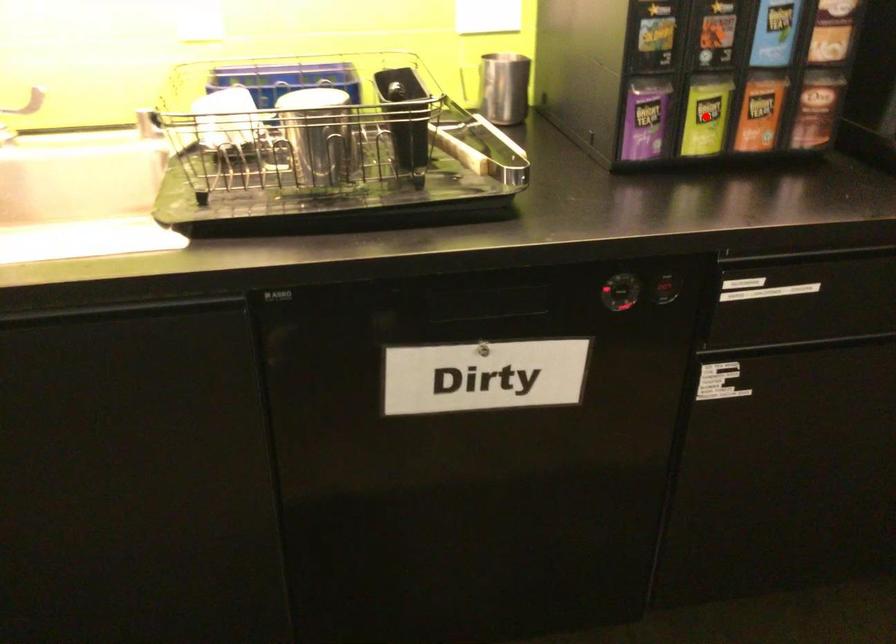
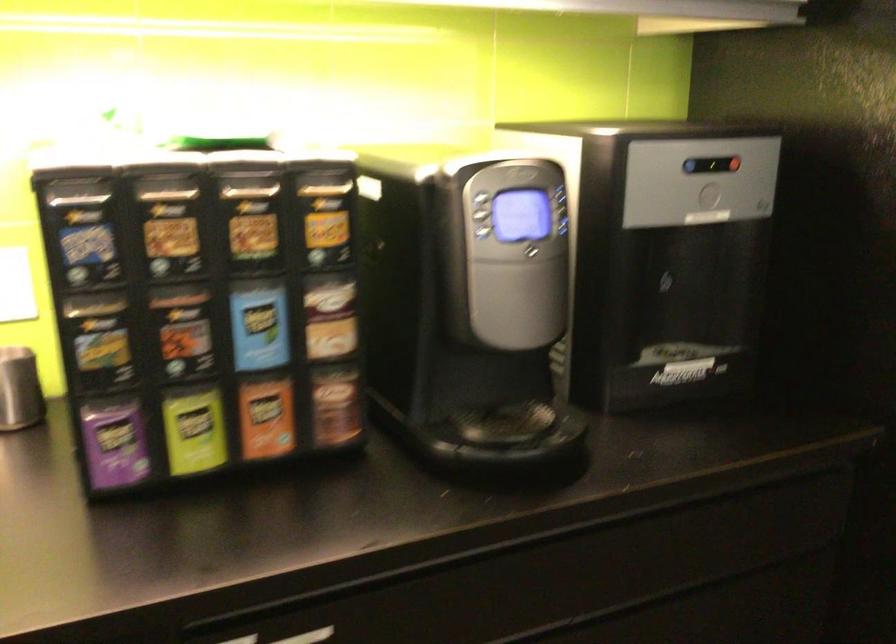
The point at the highlighted location is marked in the first image. Where is the corresponding point in the second image?

(194, 430)